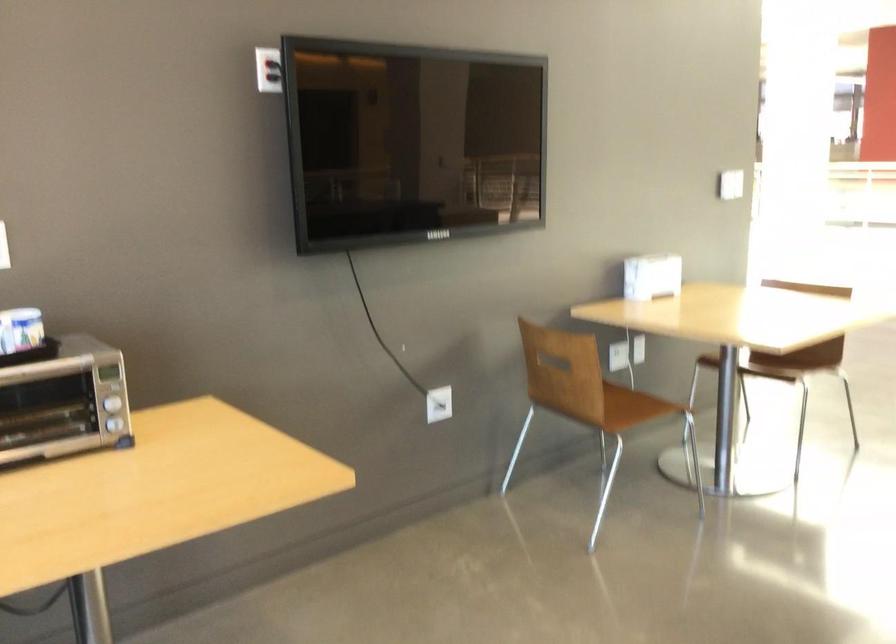
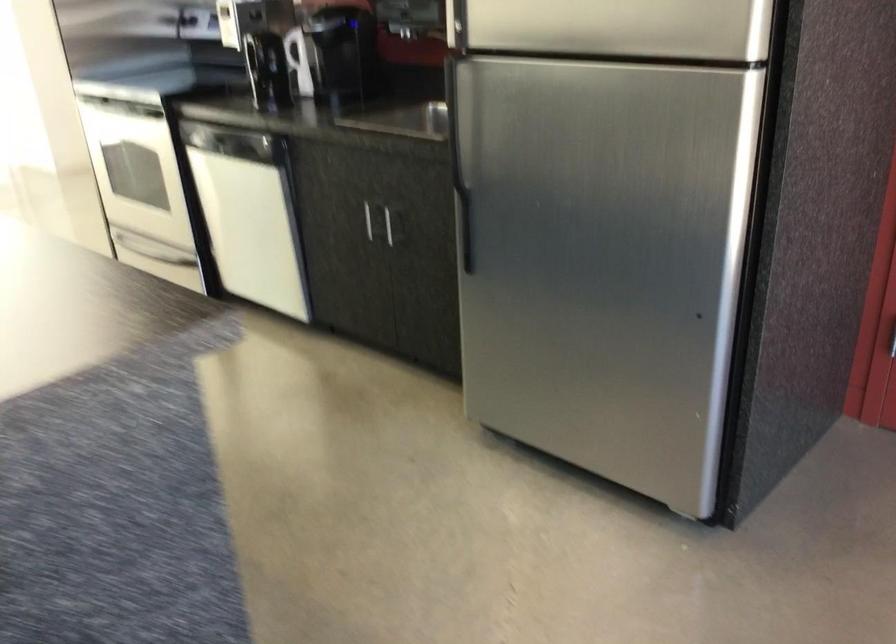
Based on the photo, the first image is from the beginning of the video and the second image is from the end. How did the camera likely rotate when shooting the video?

The rotation direction of the camera is right-down.